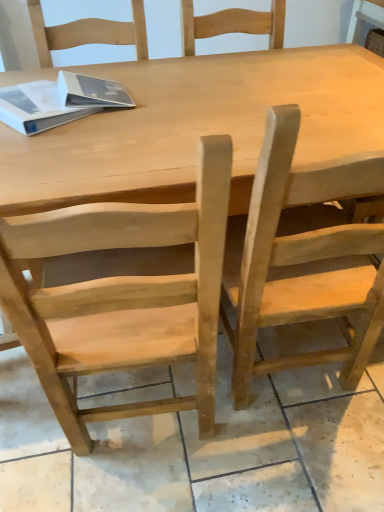
The image size is (384, 512). In order to click on vacant region to the right of white matte book at upper left in this screenshot , I will do `click(129, 111)`.